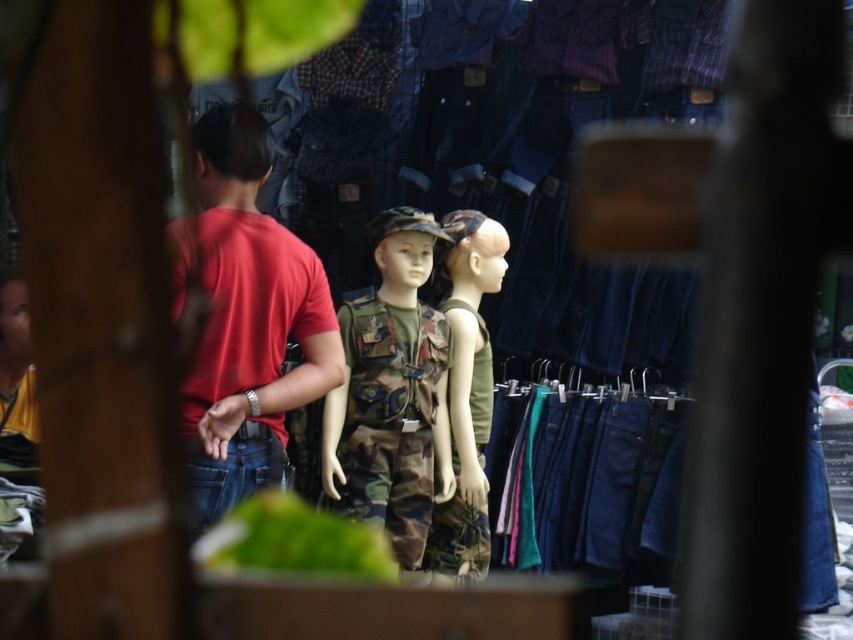
Does camo fabric vest at center have a lesser height compared to camouflage fabric shirt at center?

Correct, camo fabric vest at center is not as tall as camouflage fabric shirt at center.

Does camo fabric vest at center appear on the left side of camouflage fabric shirt at center?

Yes, camo fabric vest at center is to the left of camouflage fabric shirt at center.

Describe the element at coordinates (390, 419) in the screenshot. The width and height of the screenshot is (853, 640). I see `camo fabric vest at center` at that location.

Locate an element on the screen. Image resolution: width=853 pixels, height=640 pixels. camo fabric vest at center is located at coordinates (390, 419).

From the picture: How much distance is there between red cotton t-shirt at center and camouflage fabric shirt at center?

red cotton t-shirt at center is 6.44 feet away from camouflage fabric shirt at center.

Does red cotton t-shirt at center have a lesser height compared to camouflage fabric shirt at center?

In fact, red cotton t-shirt at center may be taller than camouflage fabric shirt at center.

Who is more distant from viewer, (256, 134) or (448, 516)?

The point (448, 516) is more distant.

I want to click on red cotton t-shirt at center, so click(248, 321).

Is red cotton t-shirt at center wider than camo fabric vest at center?

Yes, red cotton t-shirt at center is wider than camo fabric vest at center.

Who is lower down, red cotton t-shirt at center or camo fabric vest at center?

camo fabric vest at center

Is point (268, 262) positioned in front of point (415, 528)?

Yes, point (268, 262) is closer to viewer.

Where is `red cotton t-shirt at center`? The image size is (853, 640). red cotton t-shirt at center is located at coordinates (248, 321).